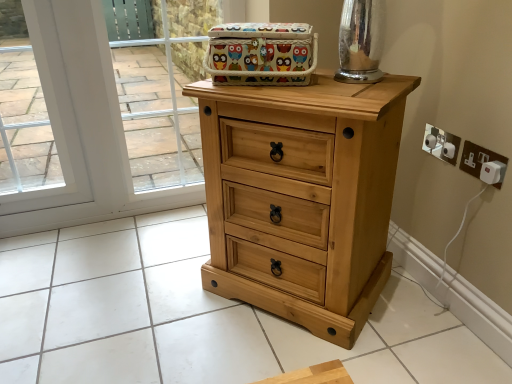
Where is `vacant area that lies in front of natural wood chest of drawers at center`? The height and width of the screenshot is (384, 512). vacant area that lies in front of natural wood chest of drawers at center is located at coordinates (306, 352).